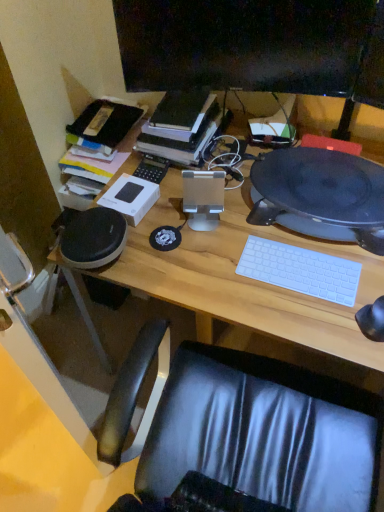
Locate an element on the screen. The height and width of the screenshot is (512, 384). free location above hardcover book at center (from a real-world perspective) is located at coordinates (179, 112).